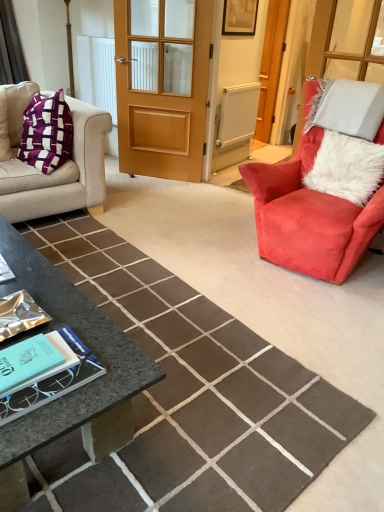
At what (x,y) coordinates should I click in order to perform the action: click on blank space situated above teal matte book at lower left (from a real-world perspective). Please return your answer as a coordinate pair (x, y). This screenshot has height=512, width=384. Looking at the image, I should click on (36, 359).